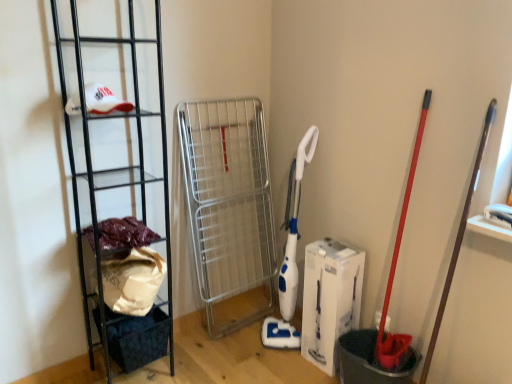
Where is `free area in between black metal rack at left and white cardboard box at center`? The width and height of the screenshot is (512, 384). free area in between black metal rack at left and white cardboard box at center is located at coordinates [231, 361].